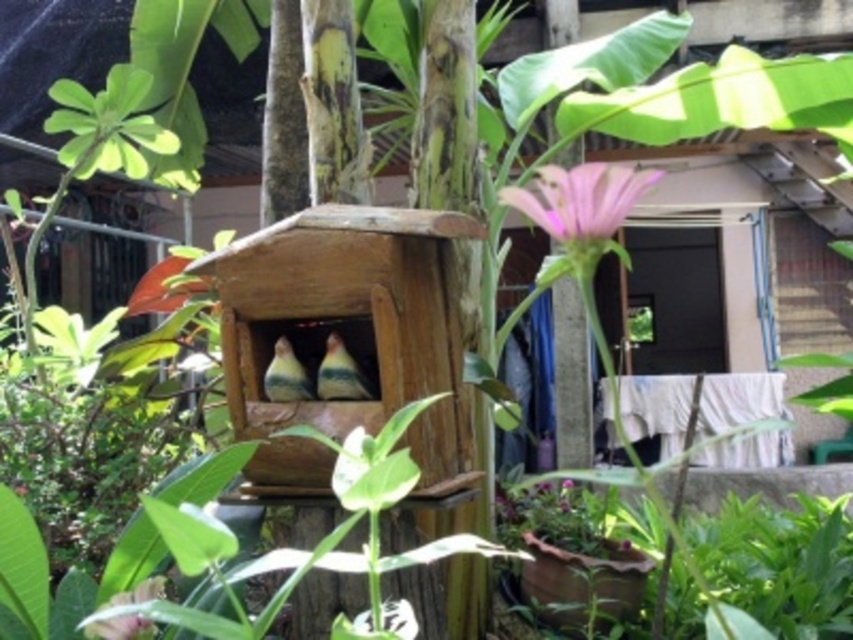
You are a gardener who wants to place a new decoration between the pink matte flower at upper center and the multicolored feathered bird at center. Based on their sizes, which object should you position closer to the center of the garden to ensure the decoration fits properly?

The pink matte flower at upper center is wider than the multicolored feathered bird at center. To ensure the decoration fits properly, position it closer to the multicolored feathered bird at center since it has a smaller width.

You are a gardener who wants to place a new statue that is 10 feet tall between the pink matte flower at upper center and the green matte bird at center. Is there enough space for the statue without moving either object?

The distance between the pink matte flower at upper center and the green matte bird at center is 13.22 feet. Since the statue is 10 feet tall, it can be placed between them as the available space is sufficient.